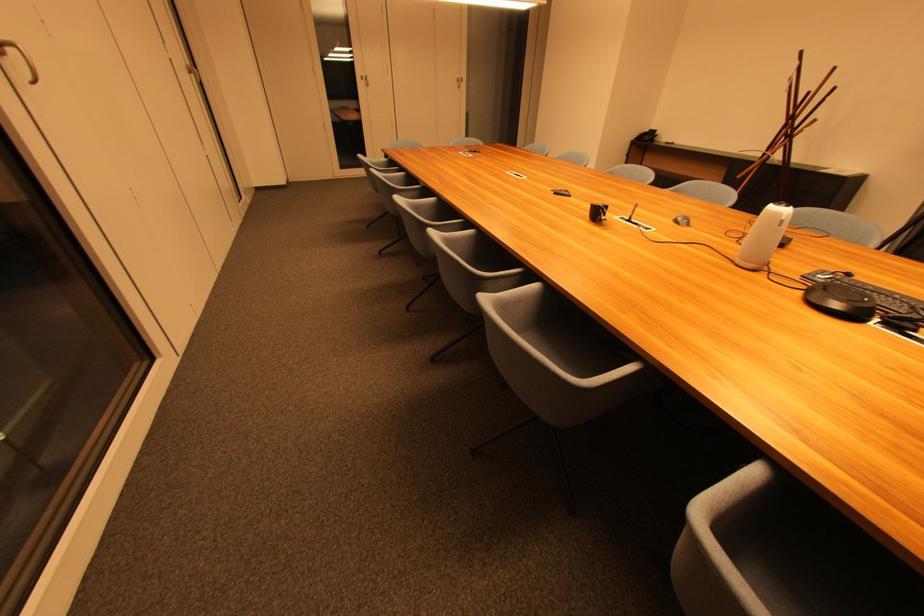
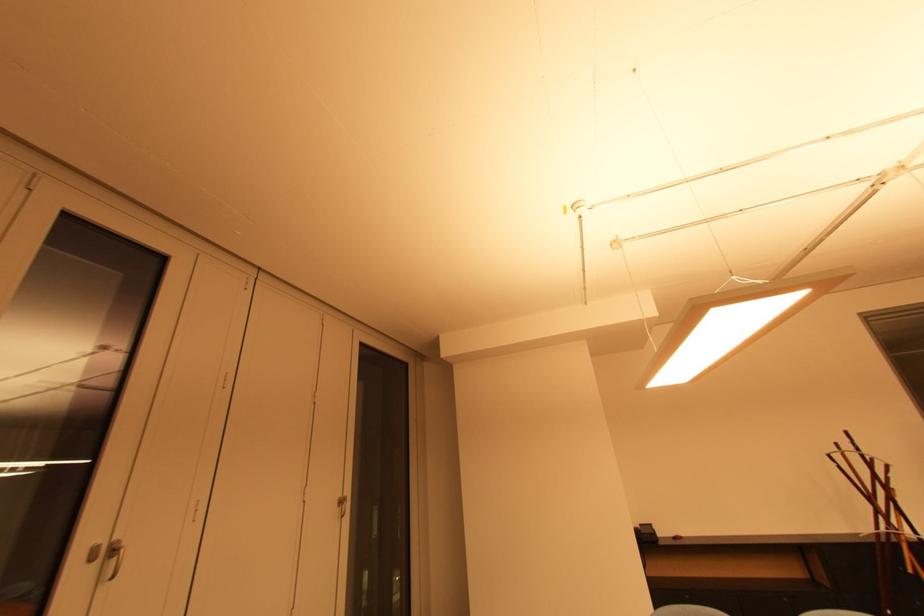
Find the pixel in the second image that matches (464,83) in the first image.

(346, 504)